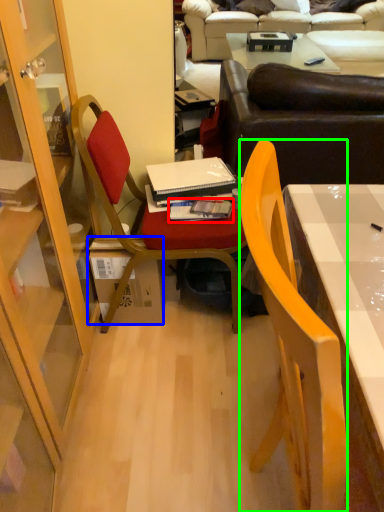
Question: Which is nearer to the book (highlighted by a red box)? box (highlighted by a blue box) or chair (highlighted by a green box).

Choices:
 (A) box
 (B) chair

Answer: (A)